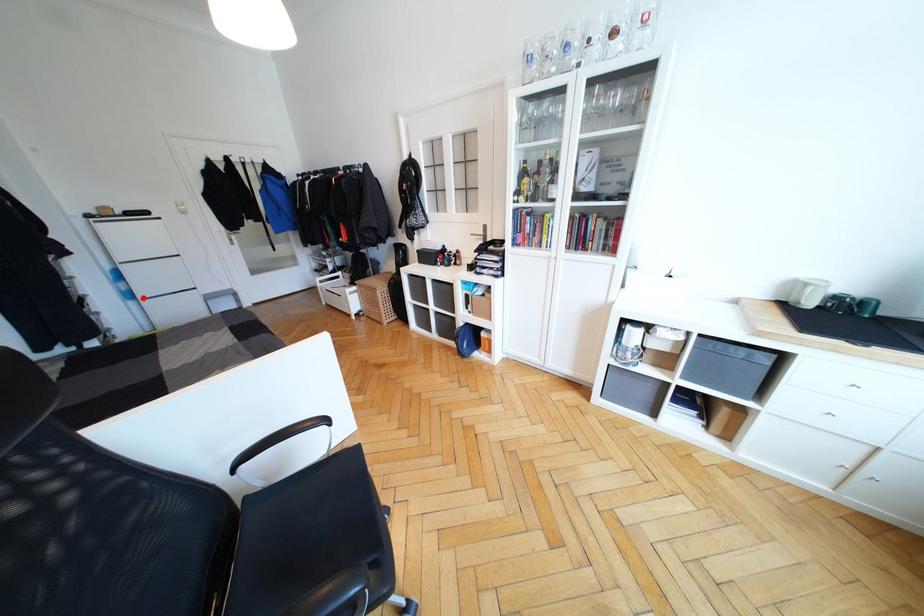
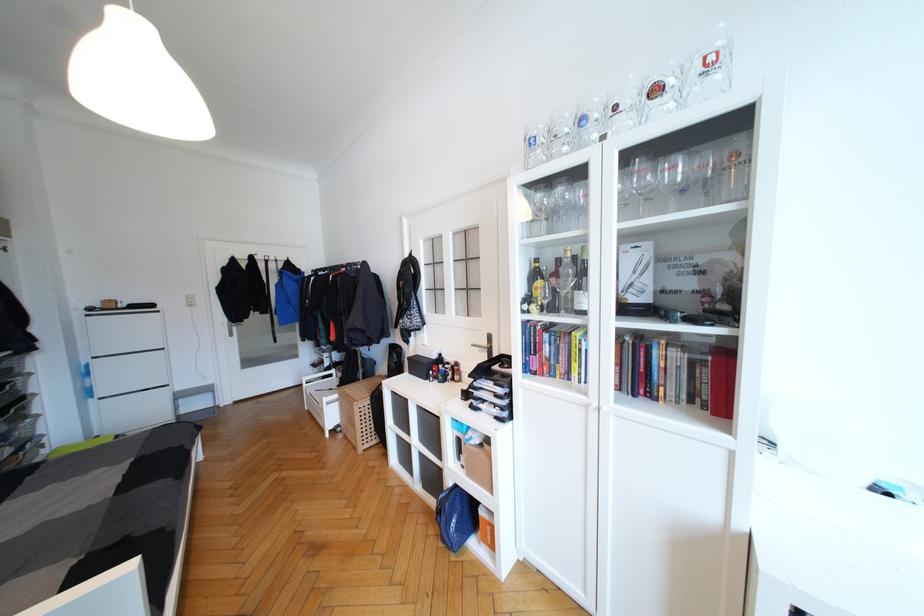
Question: I am providing you with two images of the same scene from different viewpoints. Given a red point in image1, look at the same physical point in image2. Is it:

Choices:
 (A) Closer to the viewpoint
 (B) Farther from the viewpoint

Answer: (A)